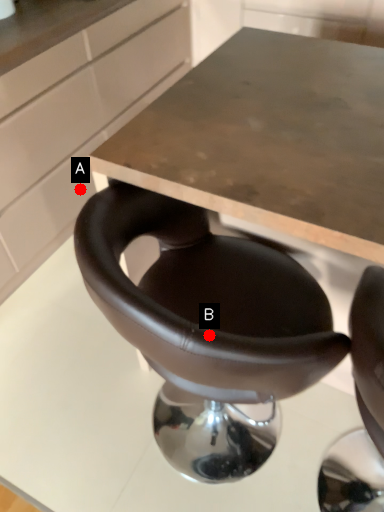
Question: Two points are circled on the image, labeled by A and B beside each circle. Which point is closer to the camera taking this photo?

Choices:
 (A) A is closer
 (B) B is closer

Answer: (B)